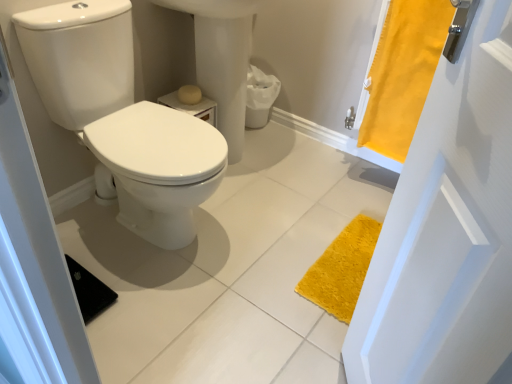
Where is `free spot below yellow fabric curtain at right (from a real-world perspective)`? The width and height of the screenshot is (512, 384). free spot below yellow fabric curtain at right (from a real-world perspective) is located at coordinates (378, 175).